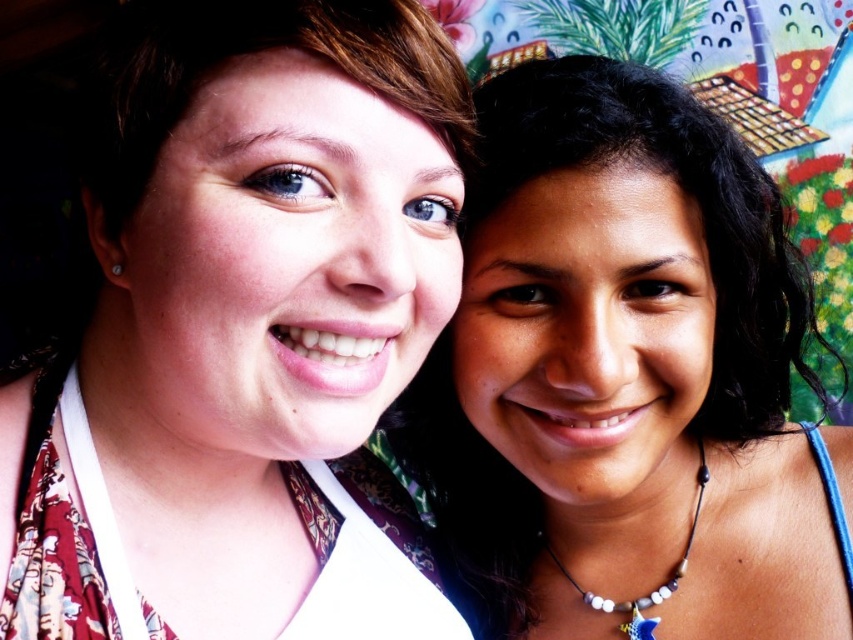
Between point (764, 333) and point (582, 596), which one is positioned behind?

The point (582, 596) is behind.

Between point (531, 408) and point (540, 538), which one is positioned in front?

Positioned in front is point (531, 408).

The width and height of the screenshot is (853, 640). Find the location of `smooth skin face at center`. smooth skin face at center is located at coordinates (631, 371).

From the picture: Which is more to the right, matte floral dress at center or beige beaded necklace with star pendant at lower right?

beige beaded necklace with star pendant at lower right

Between point (393, 291) and point (587, 596), which one is positioned behind?

The point (587, 596) is more distant.

Identify the location of matte floral dress at center. The height and width of the screenshot is (640, 853). (242, 332).

Which of these two, matte floral dress at center or smooth skin face at center, stands taller?

With more height is smooth skin face at center.

What do you see at coordinates (242, 332) in the screenshot? I see `matte floral dress at center` at bounding box center [242, 332].

Where is `matte floral dress at center`? matte floral dress at center is located at coordinates (242, 332).

Identify the location of matte floral dress at center. (242, 332).